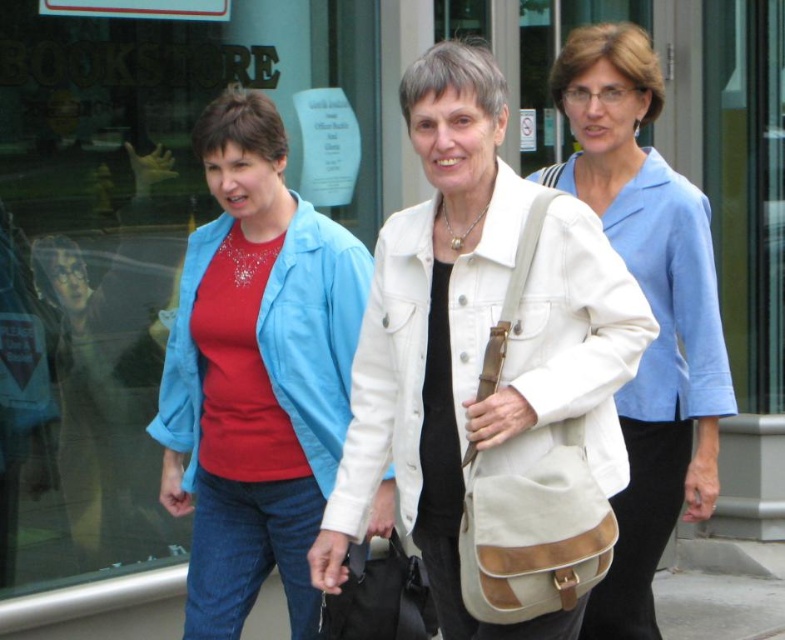
You are standing in front of the bookstore and see three women walking. There is a point marked at coordinates (x=476, y=337). What object is located at that point?

The point at coordinates (x=476, y=337) indicates the white canvas bag at center.

Looking at this image, you are a photographer trying to capture a candid shot of the two women in the scene. You want to ensure that both the matte blue jacket at center and the matte beige bag at center are clearly visible in the frame. Given their sizes, which item might require you to adjust your camera angle to avoid it being too small in the photo?

The matte blue jacket at center has a smaller size compared to the matte beige bag at center, so you might need to adjust your camera angle to ensure the matte blue jacket at center is not too small in the photo.